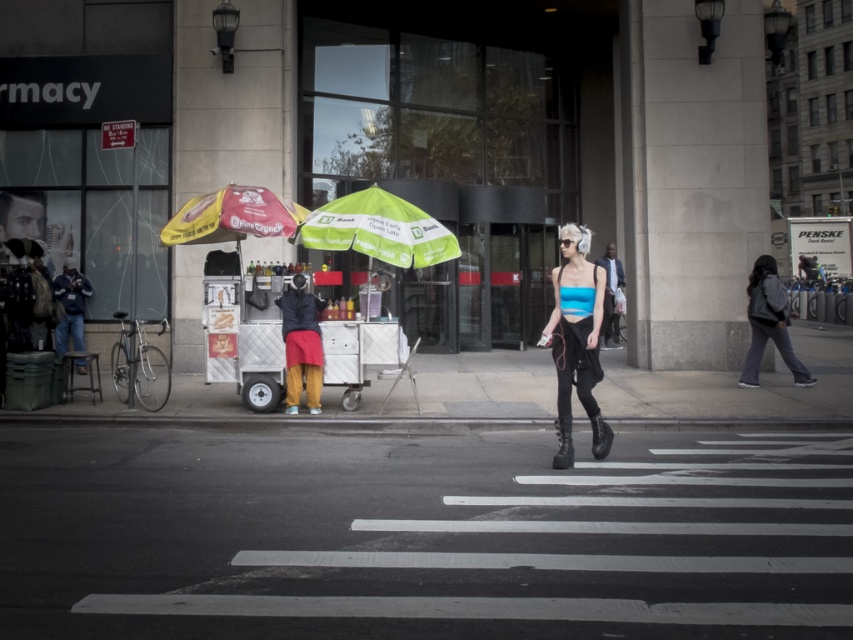
Looking at this image, is white asphalt at crosswalk center bigger than gray fabric backpack at right?

Yes.

Who is positioned more to the left, white asphalt at crosswalk center or gray fabric backpack at right?

From the viewer's perspective, white asphalt at crosswalk center appears more on the left side.

Image resolution: width=853 pixels, height=640 pixels. Describe the element at coordinates (422, 534) in the screenshot. I see `white asphalt at crosswalk center` at that location.

You are a GUI agent. You are given a task and a screenshot of the screen. Output one action in this format:
    pyautogui.click(x=<x>, y=<y>)
    Task: Click on the white asphalt at crosswalk center
    
    Given the screenshot: What is the action you would take?
    pyautogui.click(x=422, y=534)

Who is more forward, (206,228) or (311,392)?

Point (206,228) is in front.

Is yellow fabric umbrella at center-left smaller than reddish-brown fabric cart at center-left?

No.

Does point (268, 192) come farther from viewer compared to point (291, 392)?

Yes, point (268, 192) is farther from viewer.

Find the location of `yellow fabric umbrella at center-left`. yellow fabric umbrella at center-left is located at coordinates (231, 216).

Does point (352, 490) come behind point (595, 428)?

No.

Can you confirm if white asphalt at crosswalk center is positioned to the left of blue matte crop top at center?

Yes, white asphalt at crosswalk center is to the left of blue matte crop top at center.

In the scene shown: Who is more distant from viewer, (x=143, y=611) or (x=555, y=321)?

The point (x=555, y=321) is behind.

Find the location of a particular element. white asphalt at crosswalk center is located at coordinates 422,534.